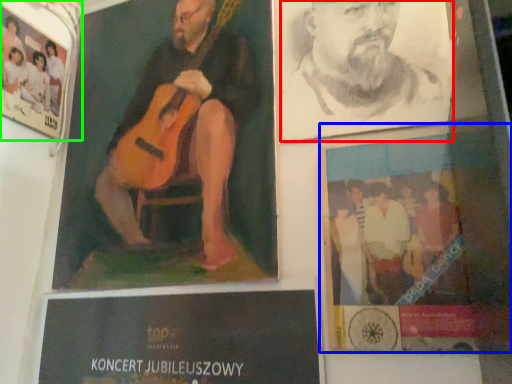
Question: Which object is positioned farthest from man (highlighted by a red box)? Select from poster (highlighted by a blue box) and poster (highlighted by a green box).

Choices:
 (A) poster
 (B) poster

Answer: (B)